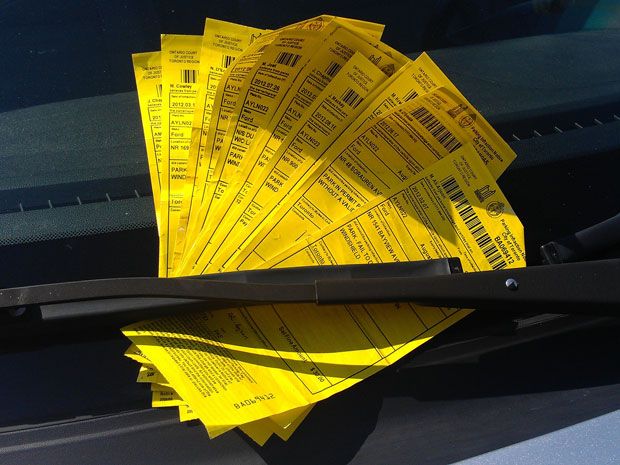
Image resolution: width=620 pixels, height=465 pixels. Identify the location of shadow inside car interior. (81, 44).